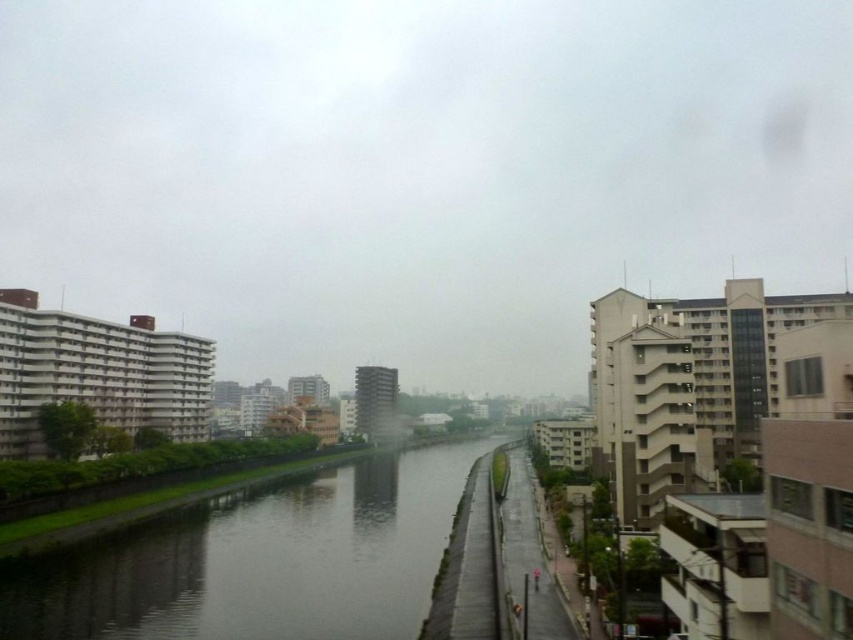
Question: Can you confirm if transparent glass sky at upper center is positioned below smooth concrete river at center?

Choices:
 (A) no
 (B) yes

Answer: (A)

Question: Is transparent glass sky at upper center thinner than smooth concrete river at center?

Choices:
 (A) yes
 (B) no

Answer: (B)

Question: Which point is closer to the camera taking this photo?

Choices:
 (A) (222, 266)
 (B) (381, 534)

Answer: (B)

Question: Among these objects, which one is nearest to the camera?

Choices:
 (A) smooth concrete river at center
 (B) transparent glass sky at upper center

Answer: (A)

Question: Which of the following is the farthest from the observer?

Choices:
 (A) (376, 618)
 (B) (38, 138)

Answer: (B)

Question: Does transparent glass sky at upper center have a lesser width compared to smooth concrete river at center?

Choices:
 (A) no
 (B) yes

Answer: (A)